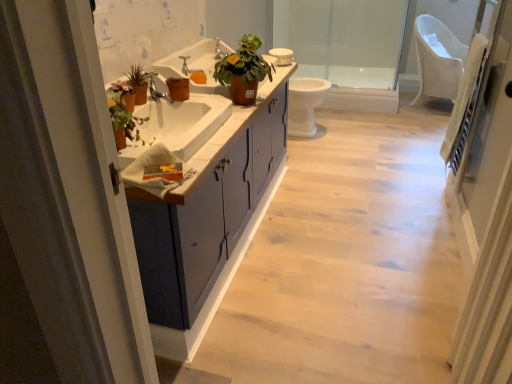
Where is `empty space that is to the right of matte gray cabinet at center`? This screenshot has width=512, height=384. empty space that is to the right of matte gray cabinet at center is located at coordinates [360, 227].